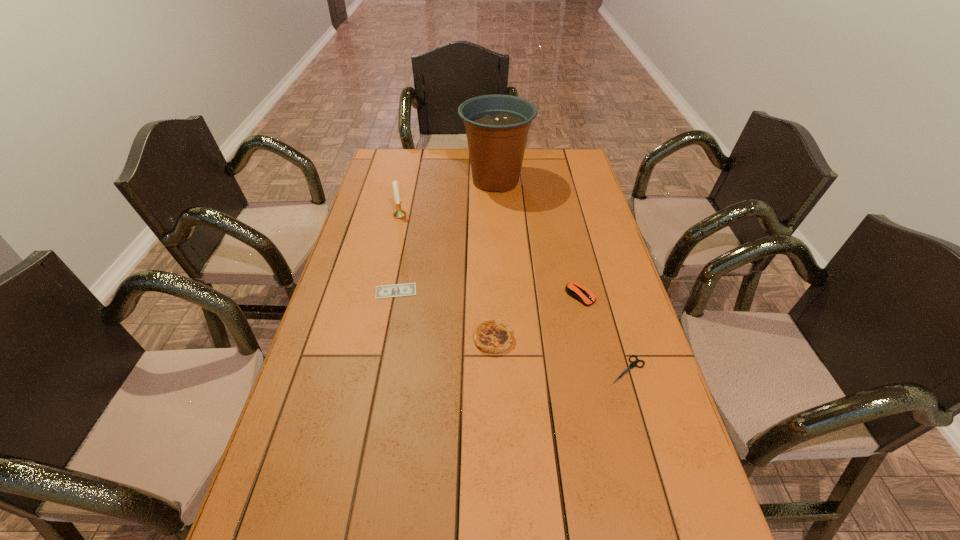
You are a GUI agent. You are given a task and a screenshot of the screen. Output one action in this format:
    pyautogui.click(x=<x>, y=<y>)
    Task: Click on the vacant region at the far edge of the desktop
    
    Given the screenshot: What is the action you would take?
    pyautogui.click(x=419, y=157)

Image resolution: width=960 pixels, height=540 pixels. Find the location of `vacant area at the left edge of the desktop`. vacant area at the left edge of the desktop is located at coordinates (392, 198).

Find the location of a particular element. free space at the right edge is located at coordinates (638, 458).

The image size is (960, 540). In the image, there is a desktop. Find the location of `vacant region at the far left corner`. vacant region at the far left corner is located at coordinates (400, 160).

Locate an element on the screen. Image resolution: width=960 pixels, height=540 pixels. vacant space that is in between the quiche and the fifth nearest object is located at coordinates (446, 277).

This screenshot has width=960, height=540. What are the coordinates of `vacant area that lies between the computer mouse and the quiche` in the screenshot? It's located at (537, 318).

Identify the location of vacant area between the second farthest object and the computer mouse. Image resolution: width=960 pixels, height=540 pixels. (490, 255).

Identify the location of empty space that is in between the shears and the computer mouse. This screenshot has height=540, width=960. [604, 333].

The height and width of the screenshot is (540, 960). Find the location of `vacant point located between the computer mouse and the quiche`. vacant point located between the computer mouse and the quiche is located at coordinates (537, 318).

At what (x,y) coordinates should I click in order to perform the action: click on empty space between the tallest object and the second farthest object. Please return your answer as a coordinate pair (x, y). The width and height of the screenshot is (960, 540). Looking at the image, I should click on [x=447, y=198].